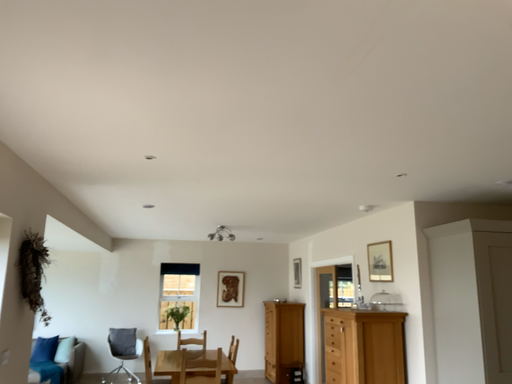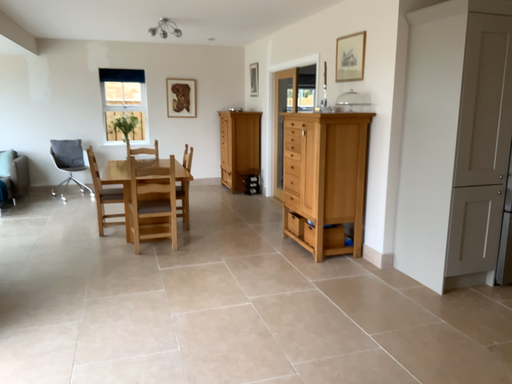
Question: Which way did the camera rotate in the video?

Choices:
 (A) rotated downward
 (B) rotated upward

Answer: (A)